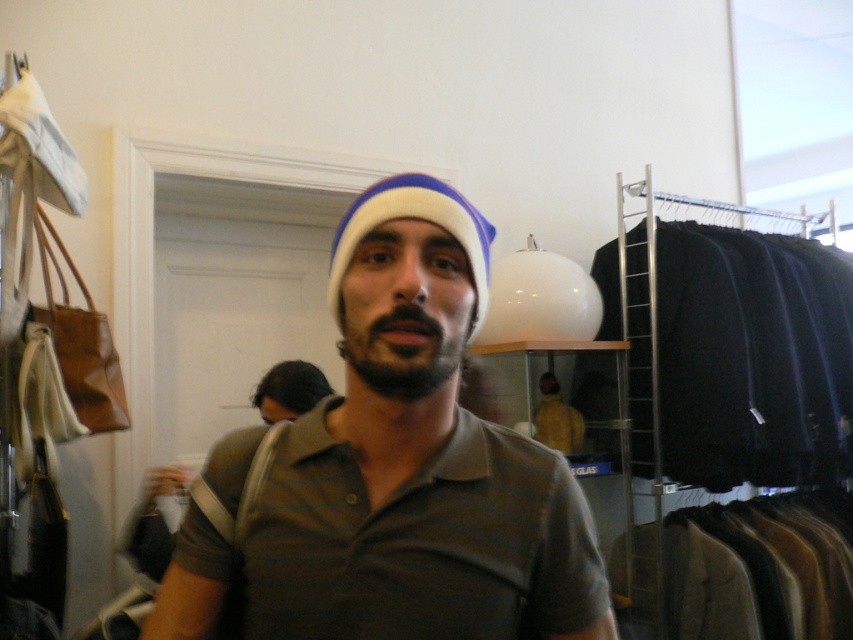
Question: Is brown striped polo shirt at center below white knit beanie at center?

Choices:
 (A) yes
 (B) no

Answer: (A)

Question: Among these objects, which one is nearest to the camera?

Choices:
 (A) brown striped polo shirt at center
 (B) green striped polo shirt at center
 (C) white knit beanie at center

Answer: (A)

Question: Which point is farther from the camera taking this photo?

Choices:
 (A) (466, 563)
 (B) (194, 532)
 (C) (413, 195)
 (D) (782, 625)

Answer: (D)

Question: Can you confirm if green striped polo shirt at center is positioned to the left of white knit beanie at center?

Choices:
 (A) no
 (B) yes

Answer: (B)

Question: Which object appears closest to the camera in this image?

Choices:
 (A) brown striped polo shirt at center
 (B) green striped polo shirt at center
 (C) black fabric at right

Answer: (A)

Question: Can you confirm if brown striped polo shirt at center is bigger than green striped polo shirt at center?

Choices:
 (A) yes
 (B) no

Answer: (A)